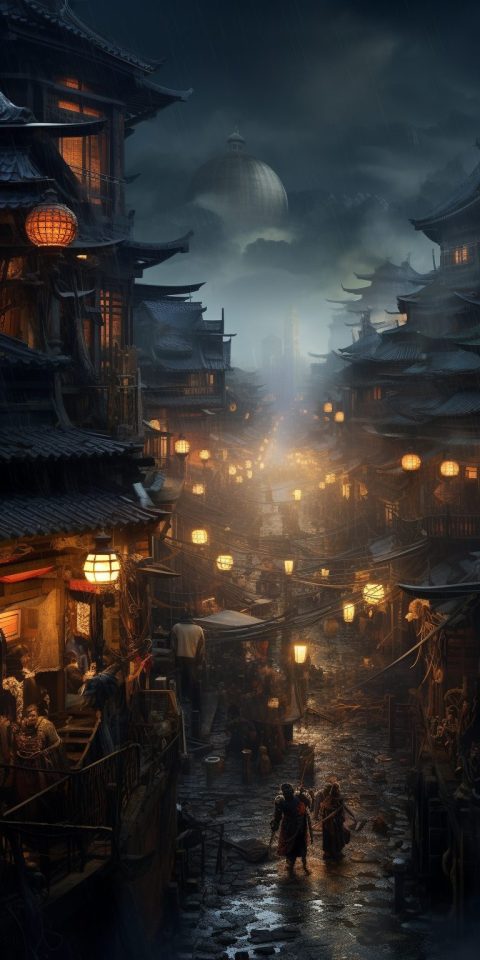
Locate an element on the screen. Image resolution: width=480 pixels, height=960 pixels. stair is located at coordinates point(73,732).